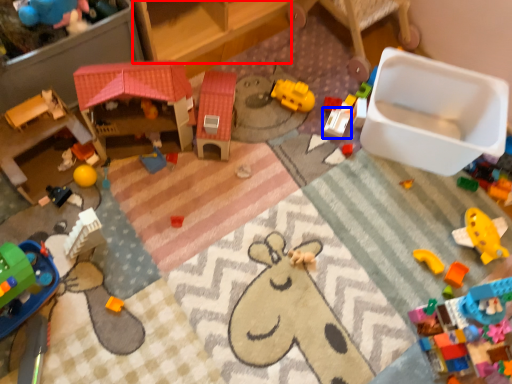
Question: Which object is further to the camera taking this photo, furniture (highlighted by a red box) or toy (highlighted by a blue box)?

Choices:
 (A) furniture
 (B) toy

Answer: (B)